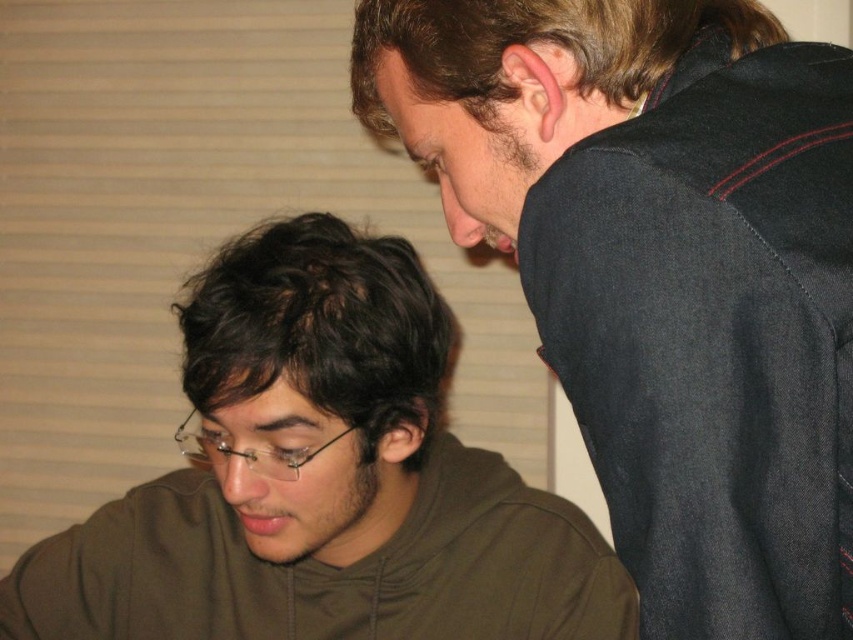
Between point (727, 451) and point (165, 609), which one is positioned in front?

Point (727, 451)

Does dark gray fabric at upper right have a greater width compared to brown matte hoodie at lower left?

In fact, dark gray fabric at upper right might be narrower than brown matte hoodie at lower left.

Describe the element at coordinates (660, 269) in the screenshot. This screenshot has width=853, height=640. I see `dark gray fabric at upper right` at that location.

Where is `dark gray fabric at upper right`? dark gray fabric at upper right is located at coordinates (660, 269).